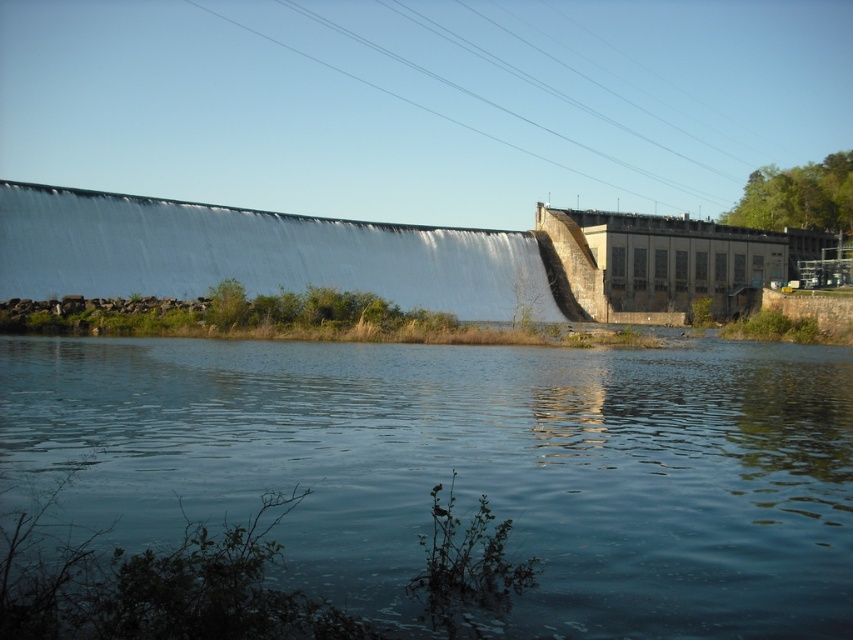
This screenshot has width=853, height=640. What do you see at coordinates (473, 467) in the screenshot?
I see `blue water at center` at bounding box center [473, 467].

The height and width of the screenshot is (640, 853). I want to click on blue water at center, so click(x=473, y=467).